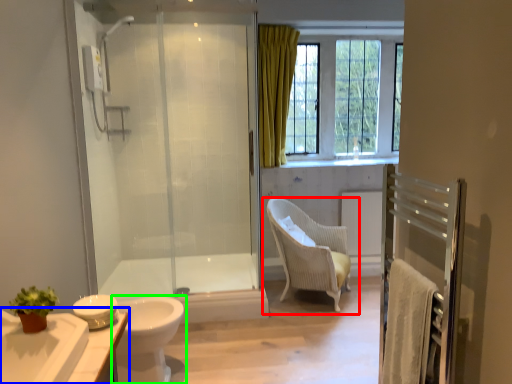
Question: Considering the real-world distances, which object is closest to chair (highlighted by a red box)? bathroom cabinet (highlighted by a blue box) or toilet (highlighted by a green box).

Choices:
 (A) bathroom cabinet
 (B) toilet

Answer: (B)